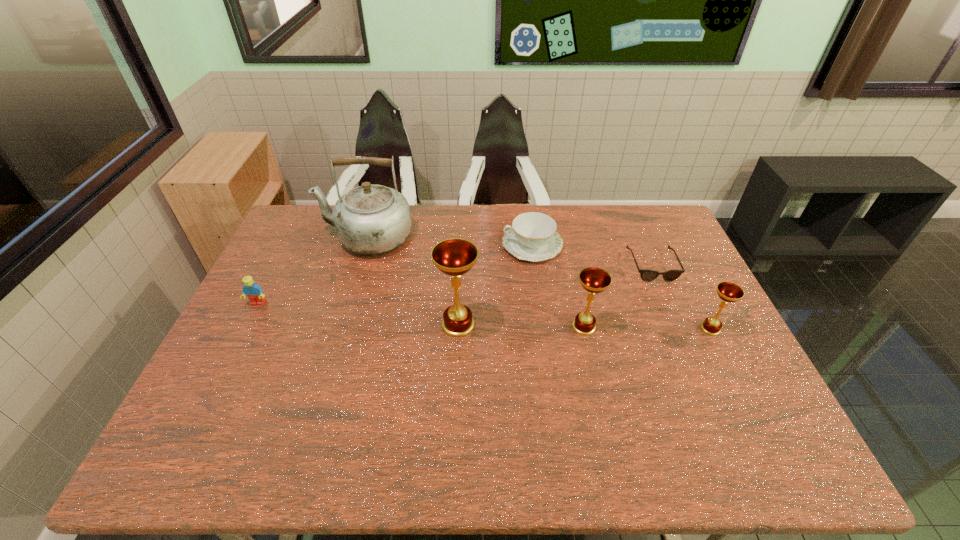
The height and width of the screenshot is (540, 960). Identify the location of free space located on the face of the third shortest object. pyautogui.click(x=217, y=384).

The width and height of the screenshot is (960, 540). Identify the location of chinaware that is at the far edge. (533, 236).

Where is `kettle located in the far edge section of the desktop`? The image size is (960, 540). kettle located in the far edge section of the desktop is located at coordinates (371, 219).

Where is `kettle that is at the left edge`? kettle that is at the left edge is located at coordinates (371, 219).

Find the location of a particular element. Lego that is positioned at the left edge is located at coordinates (251, 290).

Where is `chalice present at the right edge`? chalice present at the right edge is located at coordinates (729, 292).

This screenshot has height=540, width=960. I want to click on sunglasses that is at the right edge, so click(x=646, y=275).

Identify the location of object positioned at the far left corner. The height and width of the screenshot is (540, 960). tap(371, 219).

Where is `free point at the far edge`? Image resolution: width=960 pixels, height=540 pixels. free point at the far edge is located at coordinates (413, 218).

Locate an element on the screen. vacant space at the near edge of the desktop is located at coordinates (582, 397).